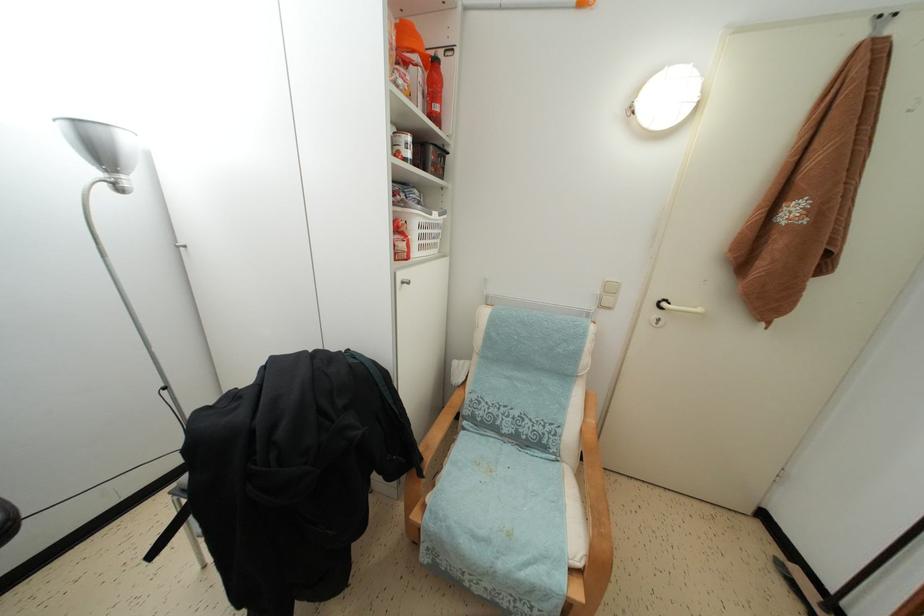
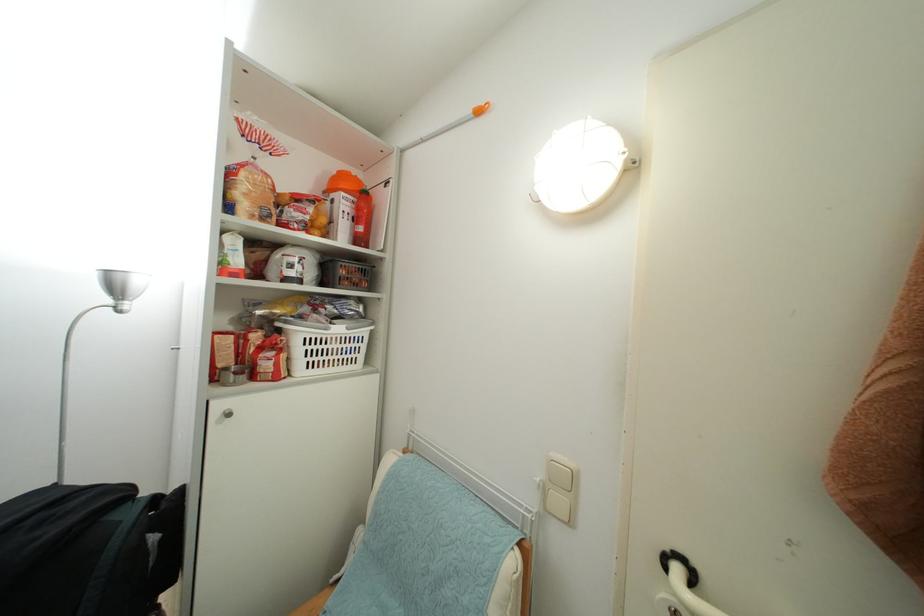
The point at (434, 220) is marked in the first image. Where is the corresponding point in the second image?

(331, 334)